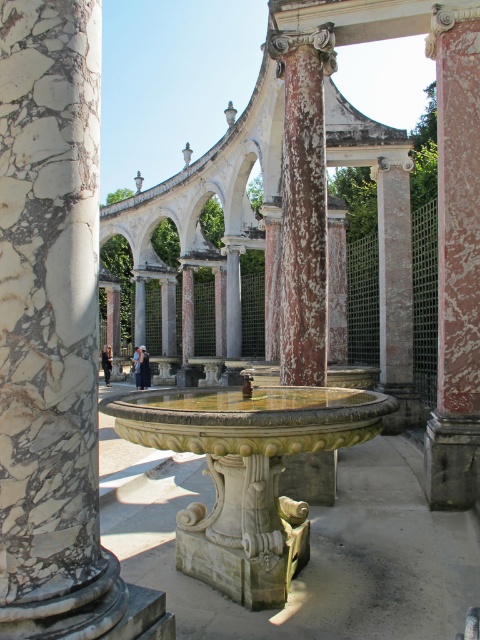
Question: Is marble column at center to the right of speckled stone column at center from the viewer's perspective?

Choices:
 (A) yes
 (B) no

Answer: (B)

Question: Which is nearer to the rustic pink stone column at center?

Choices:
 (A) stone fountain at center
 (B) speckled stone column at center

Answer: (B)

Question: Is the position of marble column at center more distant than that of stone fountain at center?

Choices:
 (A) no
 (B) yes

Answer: (A)

Question: Does stone fountain at center lie in front of rustic pink stone column at center?

Choices:
 (A) yes
 (B) no

Answer: (A)

Question: Which object appears closest to the camera in this image?

Choices:
 (A) rustic pink stone column at center
 (B) stone fountain at center

Answer: (B)

Question: Which object is positioned farthest from the rustic pink stone column at center?

Choices:
 (A) speckled stone column at center
 (B) marble column at center

Answer: (B)